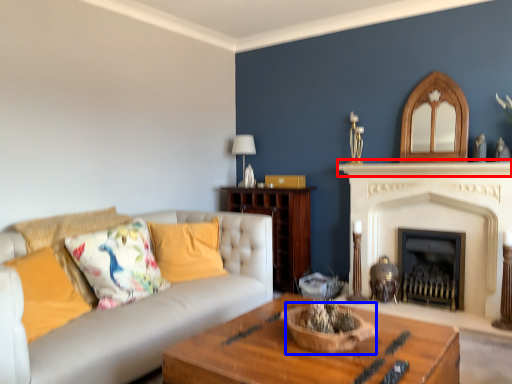
Question: Which point is further to the camera, mantle (highlighted by a red box) or basket (highlighted by a blue box)?

Choices:
 (A) mantle
 (B) basket

Answer: (A)